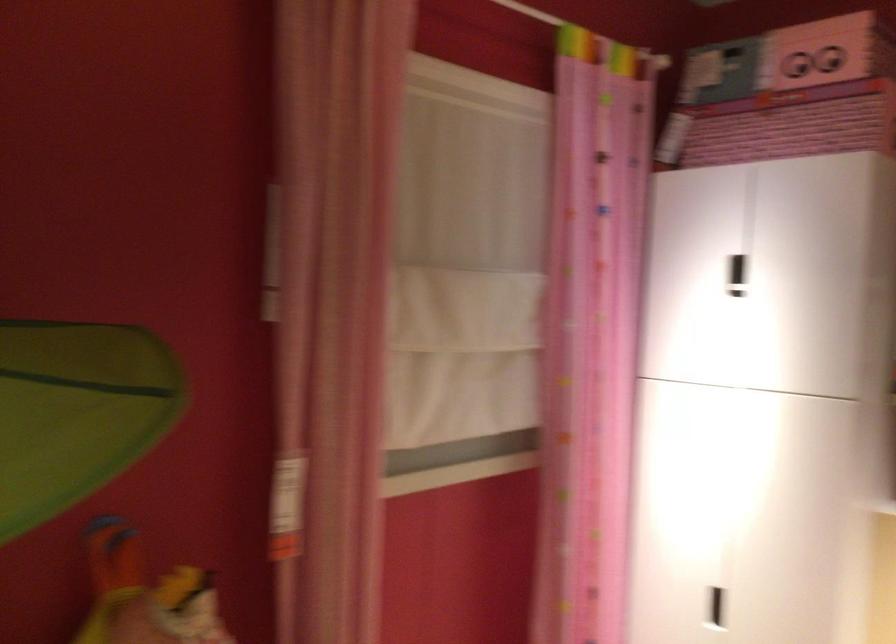
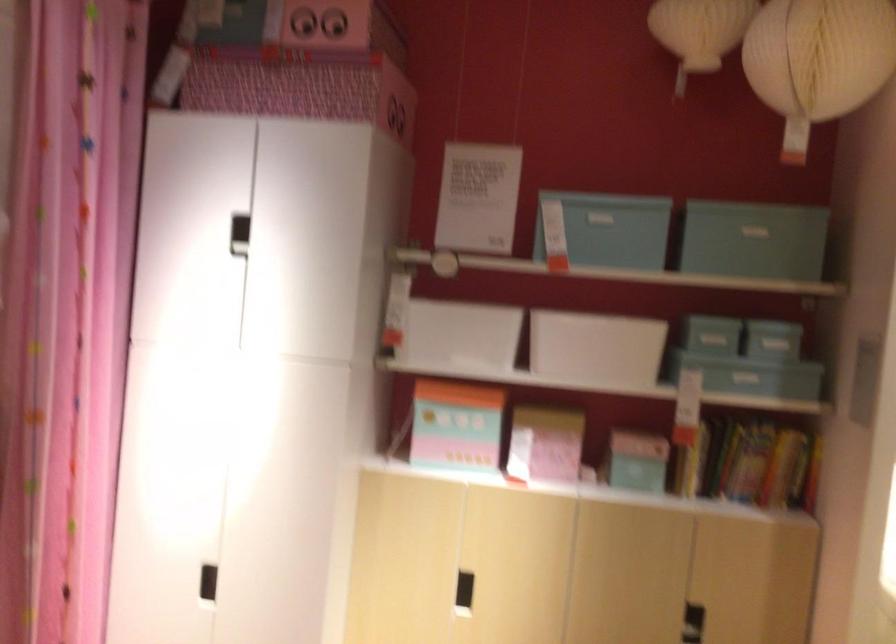
Question: The images are taken continuously from a first-person perspective. In which direction is your viewpoint rotating?

Choices:
 (A) Left
 (B) Right
 (C) Up
 (D) Down

Answer: (B)